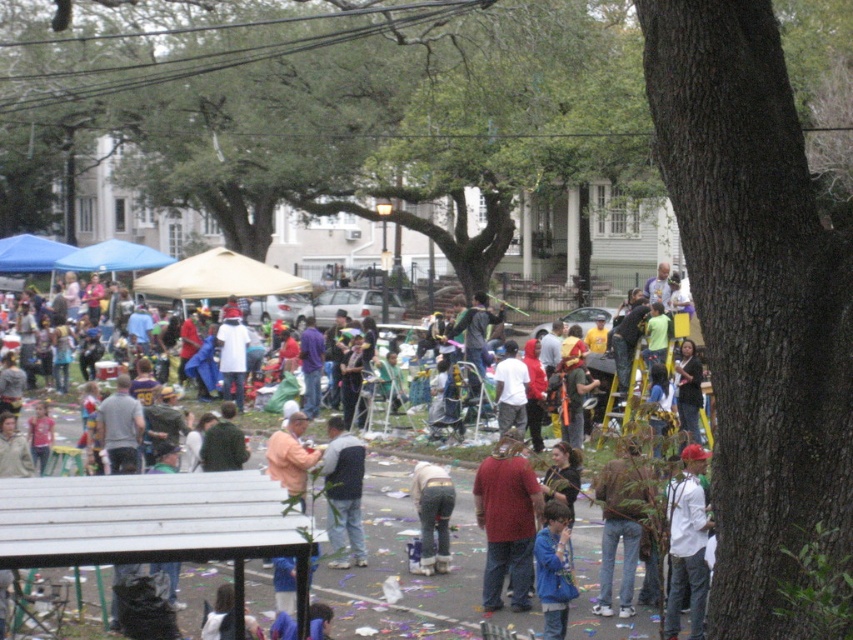
Question: Which is farther from the light gray pants at center?

Choices:
 (A) denim pants at center
 (B) matte white shirt at center
 (C) gray fabric shirt at center
 (D) dark gray sweater at center

Answer: (A)

Question: Which point is farther to the camera?

Choices:
 (A) (283, 426)
 (B) (519, 456)
 (C) (540, 560)

Answer: (A)

Question: Does matte red shirt at center appear under denim pants at center?

Choices:
 (A) yes
 (B) no

Answer: (B)

Question: Which point is closer to the camera?

Choices:
 (A) (329, 468)
 (B) (666, 634)
 (C) (596, 556)

Answer: (B)

Question: Is white matte baseball cap at center smaller than dark gray sweater at center?

Choices:
 (A) yes
 (B) no

Answer: (B)

Question: Does gray fabric shirt at center appear on the left side of light peach fabric at center?

Choices:
 (A) no
 (B) yes

Answer: (B)